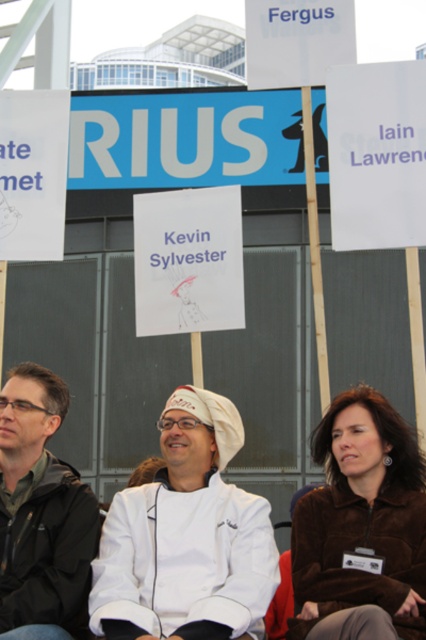
Is white matte chef coat at center above white paper sign at upper center?

No, white matte chef coat at center is not above white paper sign at upper center.

Does point (215, 600) come in front of point (276, 4)?

Yes, it is in front of point (276, 4).

Locate an element on the screen. Image resolution: width=426 pixels, height=640 pixels. white matte chef coat at center is located at coordinates (187, 538).

Between white paper at center and white paper at left, which one appears on the left side from the viewer's perspective?

Positioned to the left is white paper at left.

Who is taller, white paper at center or white paper at left?

With more height is white paper at left.

The width and height of the screenshot is (426, 640). What do you see at coordinates (187, 260) in the screenshot? I see `white paper at center` at bounding box center [187, 260].

This screenshot has width=426, height=640. In order to click on white paper at center in this screenshot , I will do `click(187, 260)`.

Consider the image. Between green matte jacket at left and white paper at left, which one appears on the right side from the viewer's perspective?

green matte jacket at left

Who is positioned more to the left, green matte jacket at left or white paper at left?

Positioned to the left is white paper at left.

Locate an element on the screen. The image size is (426, 640). green matte jacket at left is located at coordinates (40, 509).